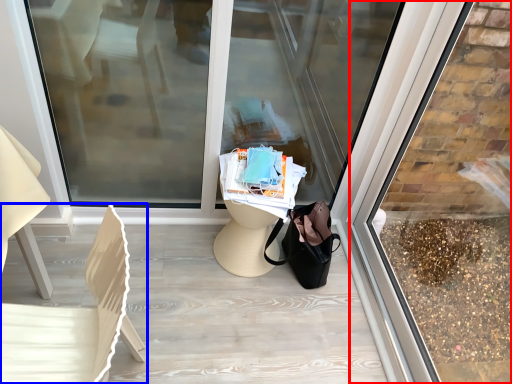
Question: Which object appears closest to the camera in this image, shop window (highlighted by a red box) or chair (highlighted by a blue box)?

Choices:
 (A) shop window
 (B) chair

Answer: (A)